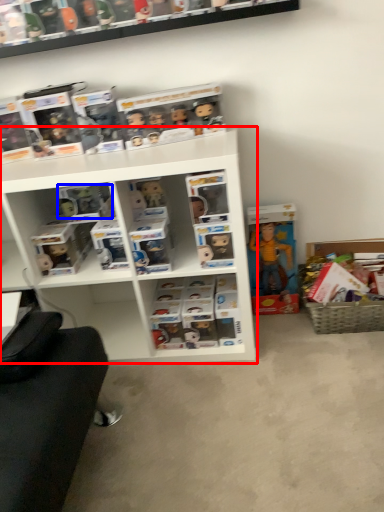
Question: Which of the following is the closest to the observer, shelf (highlighted by a red box) or toy (highlighted by a blue box)?

Choices:
 (A) shelf
 (B) toy

Answer: (A)